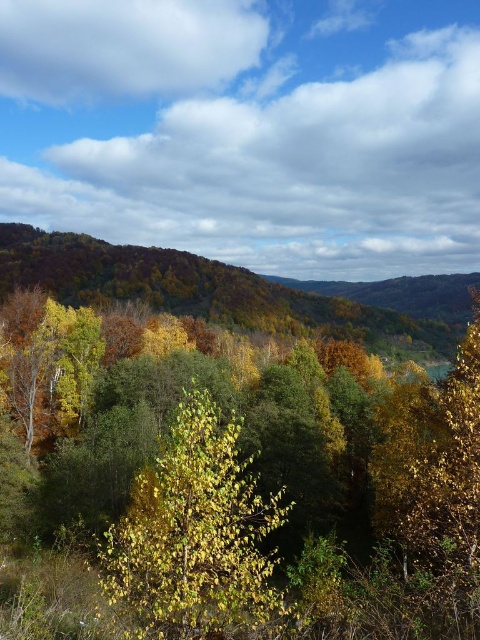
Question: Which point is closer to the camera taking this photo?

Choices:
 (A) (273, 435)
 (B) (178, 568)

Answer: (B)

Question: Can you confirm if yellow-green foliage at center is smaller than yellow-green leaves at center?

Choices:
 (A) no
 (B) yes

Answer: (A)

Question: Considering the relative positions of yellow-green foliage at center and yellow-green leaves at center in the image provided, where is yellow-green foliage at center located with respect to yellow-green leaves at center?

Choices:
 (A) above
 (B) below

Answer: (B)

Question: Which point is closer to the camera taking this photo?

Choices:
 (A) (241, 586)
 (B) (27, 372)

Answer: (A)

Question: Can you confirm if yellow-green foliage at center is thinner than yellow-green leaves at center?

Choices:
 (A) yes
 (B) no

Answer: (B)